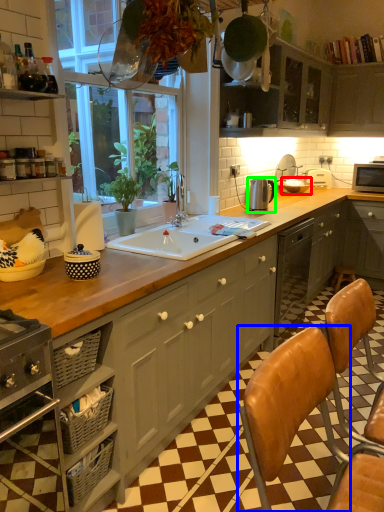
Question: Which object is the closest to the appliance (highlighted by a red box)? Choose among these: chair (highlighted by a blue box) or appliance (highlighted by a green box).

Choices:
 (A) chair
 (B) appliance

Answer: (B)